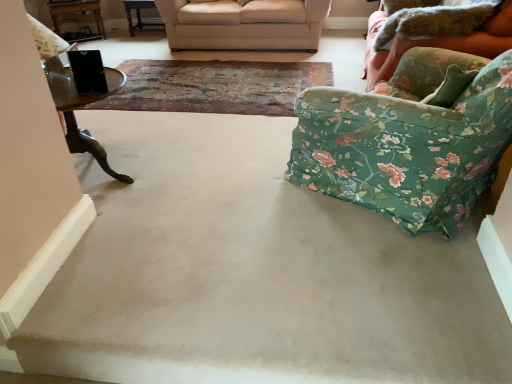
Question: Visually, is floral fabric armchair at right positioned to the left or to the right of wooden table at upper left, which ranks as the second table in right-to-left order?

Choices:
 (A) right
 (B) left

Answer: (A)

Question: From a real-world perspective, is floral fabric armchair at right physically located above or below wooden table at upper left, which ranks as the second table in right-to-left order?

Choices:
 (A) below
 (B) above

Answer: (B)

Question: Which object is positioned farthest from the wooden table at center, marked as the 2th table in a left-to-right arrangement?

Choices:
 (A) floral fabric armchair at right
 (B) floral fabric studio couch at right, the 1th studio couch positioned from the right
 (C) beige carpet at center
 (D) worn leather mat at center
 (E) wooden table at upper left, which ranks as the second table in right-to-left order

Answer: (A)

Question: Estimate the real-world distances between objects in this image. Which object is farther from the floral fabric studio couch at right, the first studio couch when ordered from front to back?

Choices:
 (A) worn leather mat at center
 (B) wooden table at upper left, which ranks as the second table in right-to-left order
 (C) floral fabric armchair at right
 (D) beige fabric couch at upper center, arranged as the 1th studio couch when viewed from the left
 (E) wooden table at center, marked as the 2th table in a left-to-right arrangement

Answer: (B)